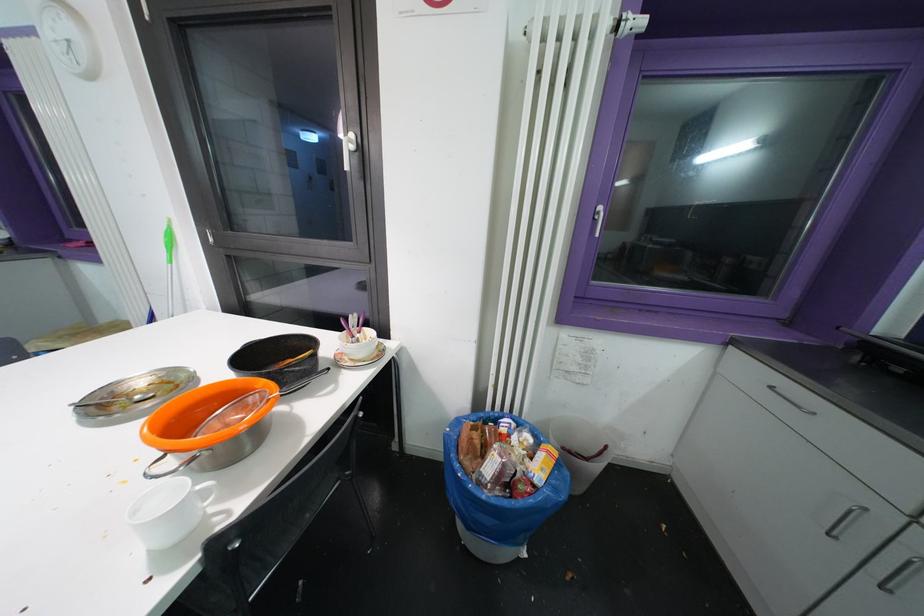
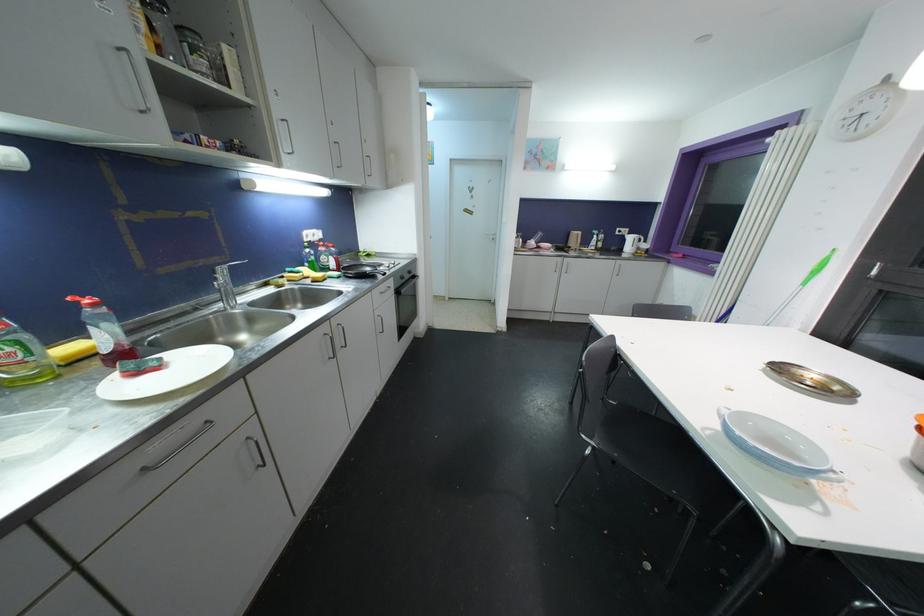
First-person continuous shooting, in which direction is the camera rotating?

The camera's rotation is toward left-down.